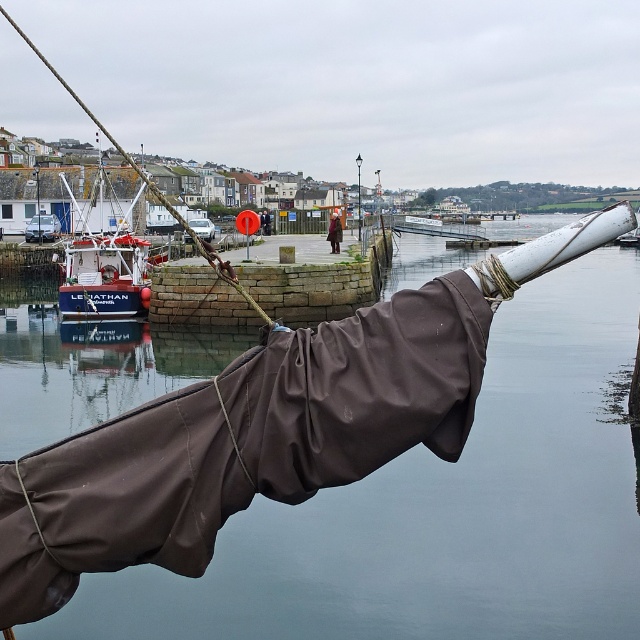
You are standing on the ship and looking at the harbor. There is a point marked at coordinates (106,273). What object is located at that point?

The point at coordinates (106,273) indicates the blue matte fishing boat at left.

You are a photographer trying to capture the entire blue matte fishing boat at left and the white plastic pole at center in a single frame. Based on their sizes, which object should you focus on to ensure both fit in the photo?

The blue matte fishing boat at left is wider than the white plastic pole at center, so you should focus on the boat to ensure both fit in the photo.

You are a photographer trying to capture the brown fabric at center without the blue matte fishing boat at left blocking it. How should you adjust your position?

The blue matte fishing boat at left is in front of the brown fabric at center, so moving to the right side of the boat would allow you to position yourself so the boat no longer blocks the view of the brown fabric at center.